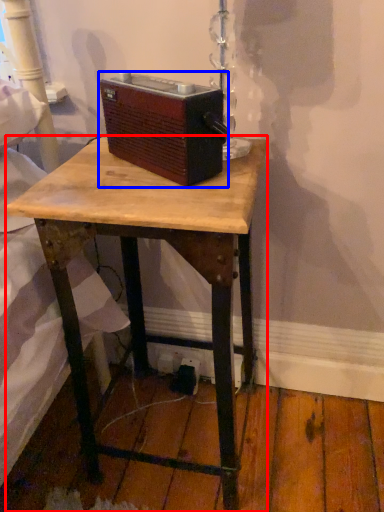
Question: Which object is closer to the camera taking this photo, desk (highlighted by a red box) or gadget (highlighted by a blue box)?

Choices:
 (A) desk
 (B) gadget

Answer: (A)